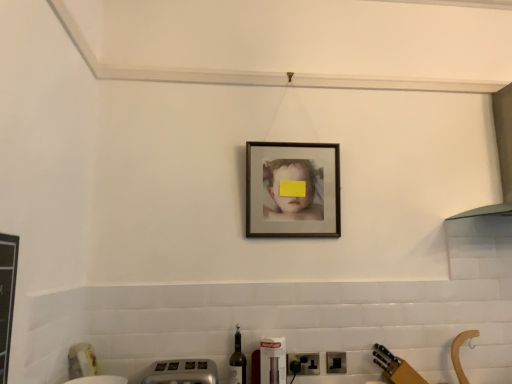
Question: Considering their positions, is translucent glass wine bottle at lower center located in front of or behind black plastic electric outlet at lower center, placed as the second electric outlet when sorted from left to right?

Choices:
 (A) front
 (B) behind

Answer: (A)

Question: Is translucent glass wine bottle at lower center situated inside black plastic electric outlet at lower center, positioned as the 1th electric outlet in right-to-left order, or outside?

Choices:
 (A) inside
 (B) outside

Answer: (B)

Question: Estimate the real-world distances between objects in this image. Which object is closer to the black plastic electric outlet at lower center, placed as the second electric outlet when sorted from left to right?

Choices:
 (A) metallic silver toaster at lower center
 (B) white glossy exhaust hood at upper right
 (C) translucent glass wine bottle at lower center
 (D) black plastic electric outlet at lower center, arranged as the first electric outlet when viewed from the left
 (E) matte wooden picture frame at center

Answer: (D)

Question: Which object is the farthest from the metallic silver toaster at lower center?

Choices:
 (A) black plastic electric outlet at lower center, arranged as the first electric outlet when viewed from the left
 (B) translucent glass wine bottle at lower center
 (C) matte wooden picture frame at center
 (D) white glossy exhaust hood at upper right
 (E) black plastic electric outlet at lower center, placed as the second electric outlet when sorted from left to right

Answer: (D)